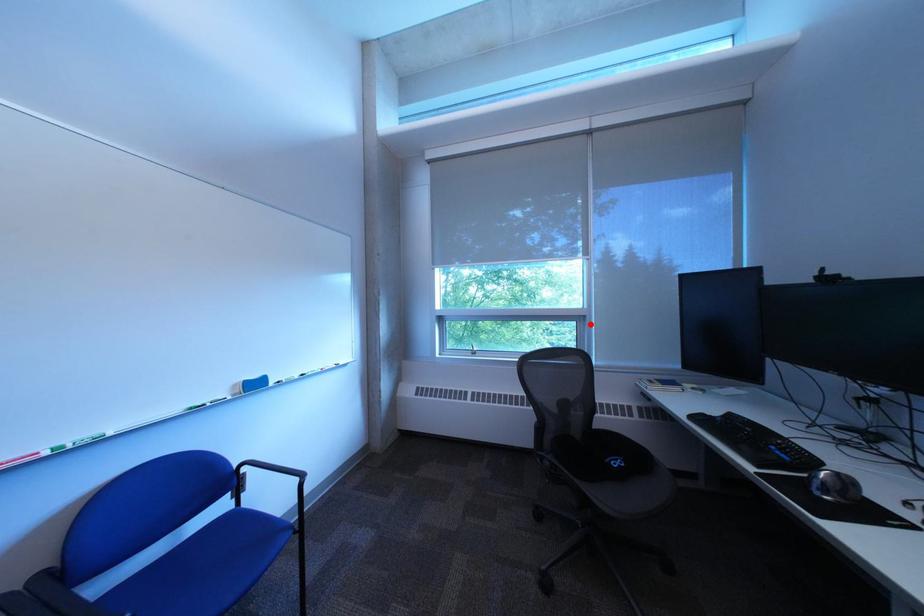
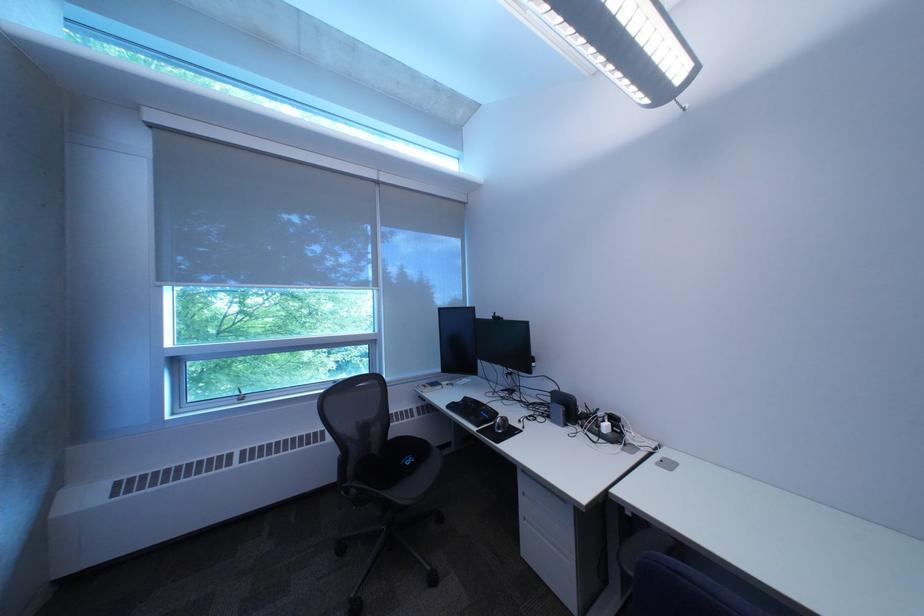
Question: I am providing you with two images of the same scene from different viewpoints. Given a red point in image1, look at the same physical point in image2. Is it:

Choices:
 (A) Closer to the viewpoint
 (B) Farther from the viewpoint

Answer: (B)